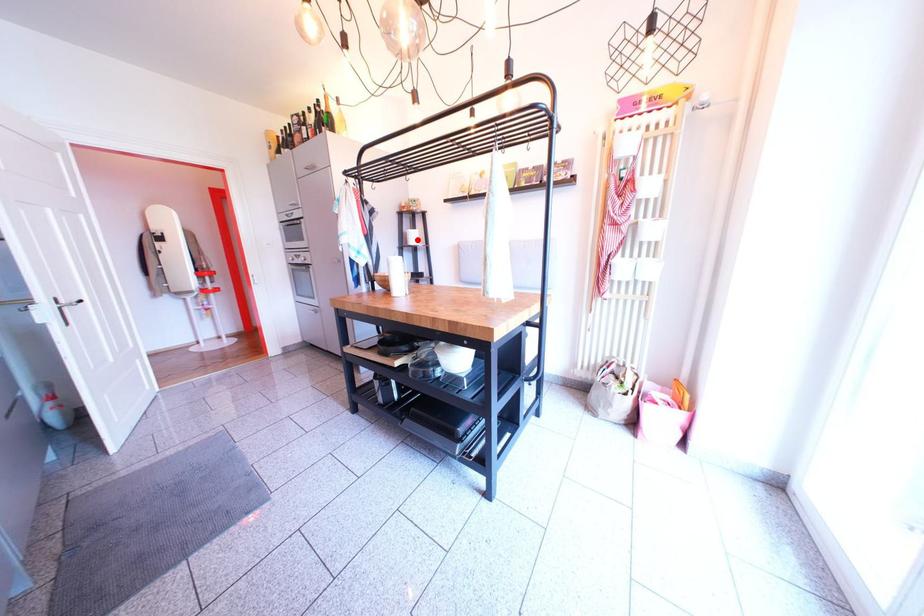
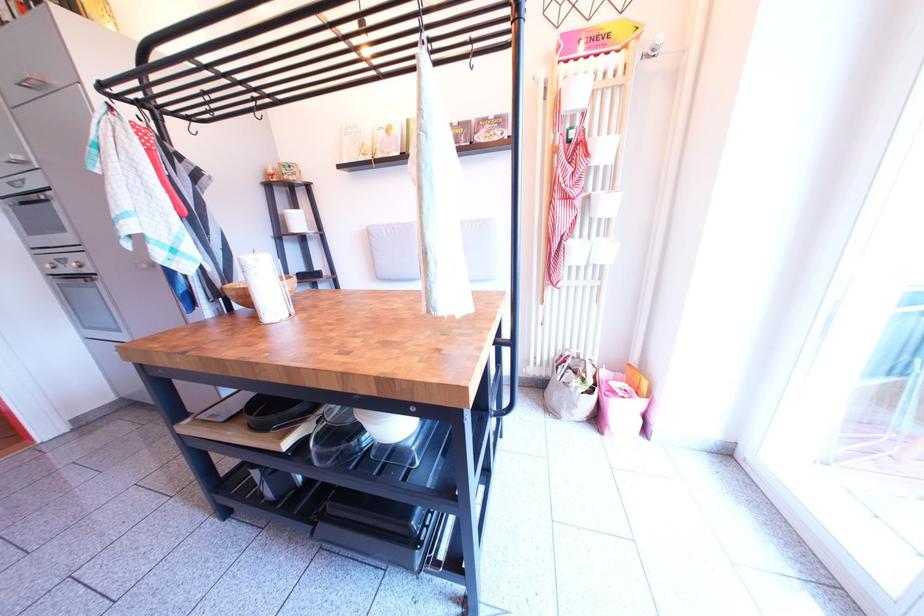
The point at the highlighted location is marked in the first image. Where is the corresponding point in the second image?

(295, 222)